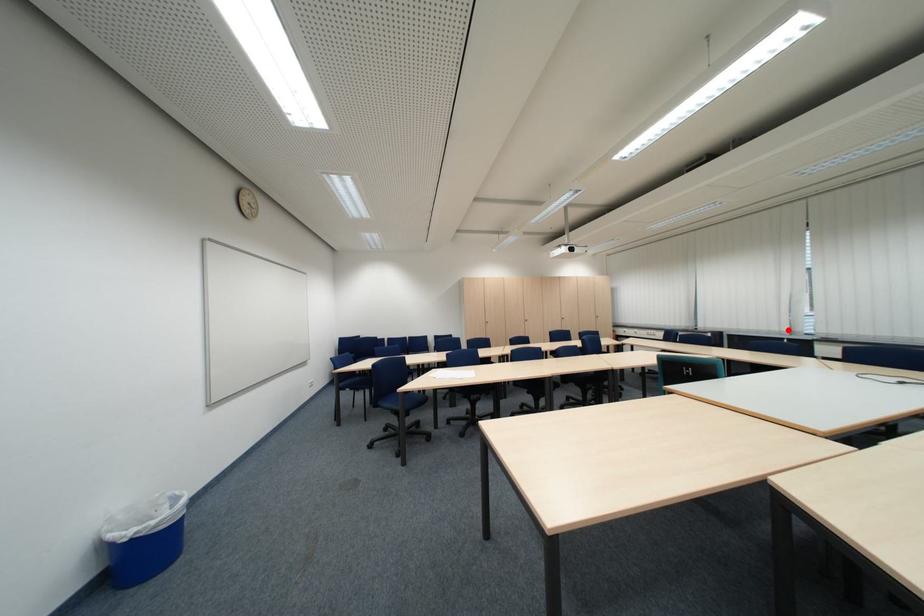
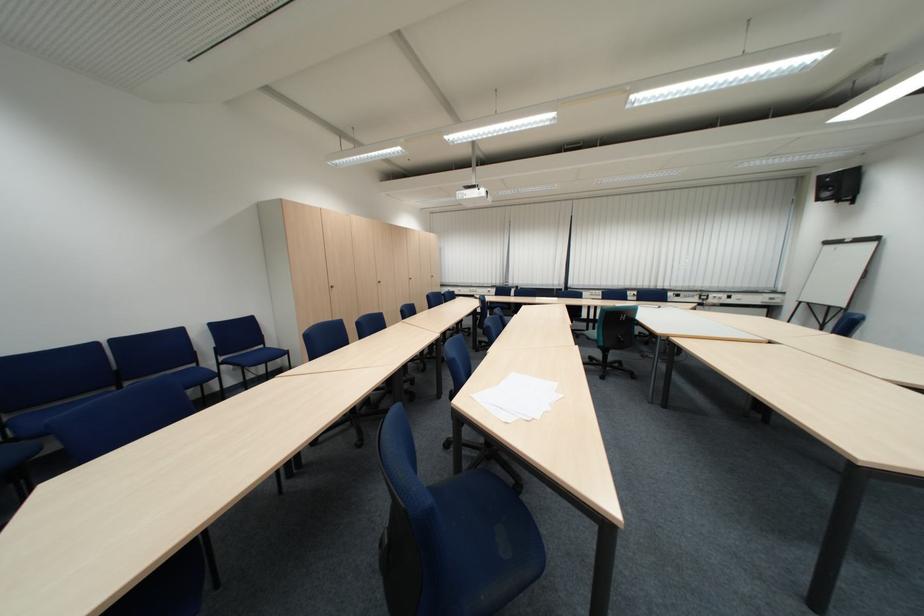
Find the pixel in the second image that matches the highlighted location in the first image.

(564, 284)